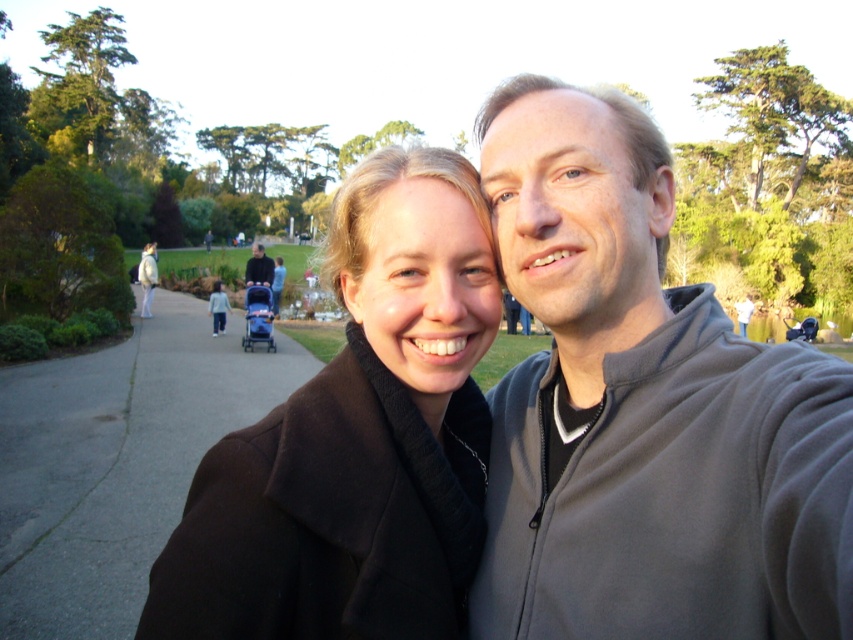
Based on the photo, you are a photographer trying to capture the two friends in the foreground without any distractions. Since you want the gray fleece sweatshirt at upper right and dark gray asphalt at lower left to be in the frame, which object should you make sure is narrower in your shot?

The gray fleece sweatshirt at upper right is narrower than the dark gray asphalt at lower left, so you should ensure the gray fleece sweatshirt at upper right takes up less width in the frame to avoid distractions.

You are a photographer trying to capture the two friends in the selfie scene. You want to ensure that both the gray fleece sweatshirt at upper right and the dark gray asphalt at lower left are clearly visible in your shot. Given their distance apart, what is the minimum focal length you should use to include both elements in the frame?

To include both the gray fleece sweatshirt at upper right and the dark gray asphalt at lower left, which are 5.89 meters apart, you should use a wide angle lens with a focal length of 35mm or lower to ensure both elements fit within the frame.

You are standing at the center of the image and want to walk towards the gray fleece sweatshirt at upper right. Which direction should you turn to face the dark gray asphalt at lower left before moving forward?

The gray fleece sweatshirt at upper right is to the right of the dark gray asphalt at lower left. To face the dark gray asphalt at lower left, you should turn left from your current position at the center.